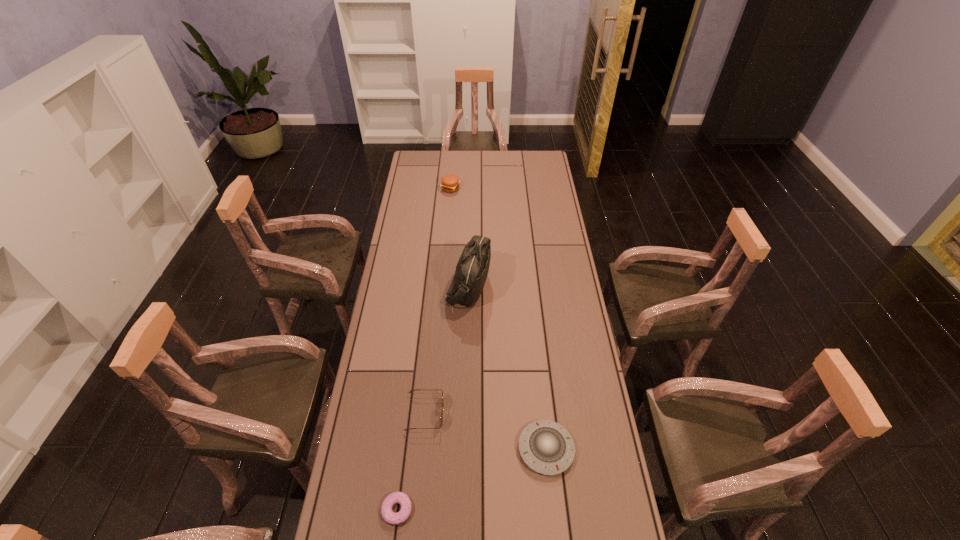
Locate an element on the screen. The width and height of the screenshot is (960, 540). the fourth nearest object is located at coordinates (471, 272).

The width and height of the screenshot is (960, 540). Find the location of `shoulder bag`. shoulder bag is located at coordinates (471, 272).

Where is `the farthest object`? The height and width of the screenshot is (540, 960). the farthest object is located at coordinates (450, 183).

Locate an element on the screen. sunglasses is located at coordinates (441, 417).

The width and height of the screenshot is (960, 540). What are the coordinates of `saucer` in the screenshot? It's located at (546, 447).

Identify the location of the rightmost object. The height and width of the screenshot is (540, 960). (546, 447).

This screenshot has width=960, height=540. Find the location of `doughnut`. doughnut is located at coordinates (390, 517).

This screenshot has width=960, height=540. In order to click on the shortest object in this screenshot , I will do `click(390, 517)`.

At what (x,y) coordinates should I click in order to perform the action: click on vacant space located at the front padded panel of the fourth nearest object. Please return your answer as a coordinate pair (x, y). The image size is (960, 540). Looking at the image, I should click on (528, 284).

The width and height of the screenshot is (960, 540). Find the location of `free space located 0.300m on the right of the hamburger`. free space located 0.300m on the right of the hamburger is located at coordinates (516, 188).